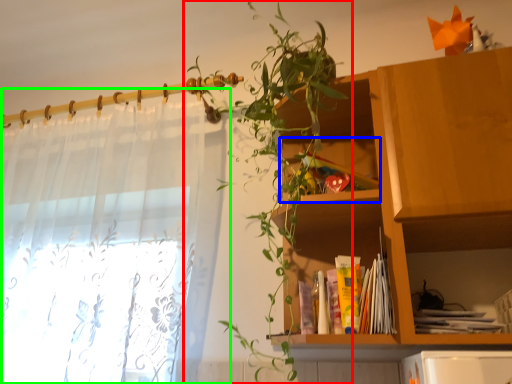
Question: Based on their relative distances, which object is farther from houseplant (highlighted by a red box)? Choose from cabinet (highlighted by a blue box) and curtain (highlighted by a green box).

Choices:
 (A) cabinet
 (B) curtain

Answer: (B)